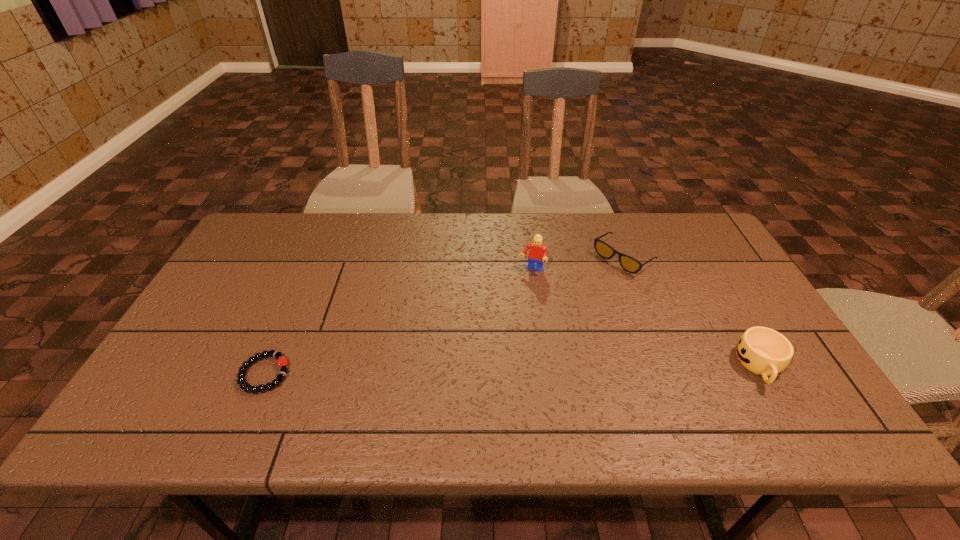
In the image, there is a desktop. At what (x,y) coordinates should I click in order to perform the action: click on vacant area at the far edge. Please return your answer as a coordinate pair (x, y). Image resolution: width=960 pixels, height=540 pixels. Looking at the image, I should click on (551, 234).

The image size is (960, 540). I want to click on vacant space at the near edge of the desktop, so click(443, 391).

The width and height of the screenshot is (960, 540). I want to click on vacant area at the left edge of the desktop, so click(x=234, y=330).

The image size is (960, 540). In order to click on free space at the far left corner of the desktop in this screenshot , I will do `click(272, 225)`.

The width and height of the screenshot is (960, 540). I want to click on vacant position at the near left corner of the desktop, so click(x=196, y=373).

Find the location of a particular element. The width and height of the screenshot is (960, 540). blank space at the far right corner of the desktop is located at coordinates (712, 249).

Locate an element on the screen. vacant area between the tallest object and the shortest object is located at coordinates pos(398,322).

The height and width of the screenshot is (540, 960). In order to click on free area in between the rightmost object and the sunglasses in this screenshot , I will do `click(692, 312)`.

Find the location of `empty space that is in between the tallest object and the shortest object`. empty space that is in between the tallest object and the shortest object is located at coordinates (398, 322).

At what (x,y) coordinates should I click in order to perform the action: click on empty location between the bracelet and the third object from left to right. Please return your answer as a coordinate pair (x, y). This screenshot has height=540, width=960. Looking at the image, I should click on [x=444, y=316].